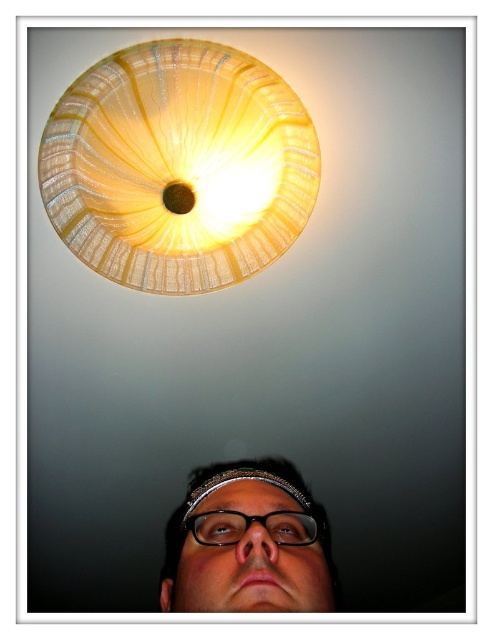
From the picture: You are an interior designer trying to ensure proper lighting in a room. You have a translucent glass lampshade at upper center and matte black glasses at lower center. Which object would cast a wider shadow when illuminated?

The translucent glass lampshade at upper center is larger in size than the matte black glasses at lower center, so it would cast a wider shadow.

You are holding a ladder that is 1.5 meters tall. You need to reach the translucent glass lampshade at upper center to change its bulb. Can you safely reach it with the ladder you have?

The distance between the translucent glass lampshade at upper center and the camera is 1.40 meters. Since the ladder is 1.5 meters tall, it is slightly taller than the required distance, so you can safely reach the translucent glass lampshade at upper center with the ladder you have.

You are standing in a room with a ceiling light fixture and looking at a person below. The ceiling light is at point [178,166]. Where is the translucent glass lampshade located?

The translucent glass lampshade is located at point [178,166].